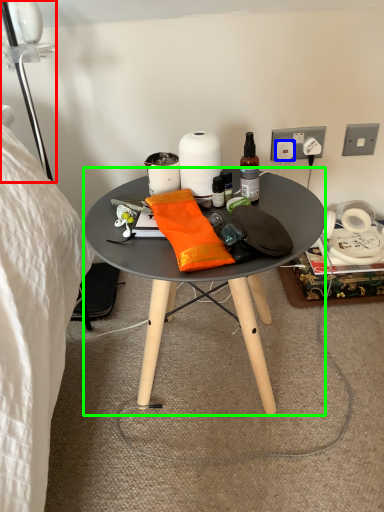
Question: Which is nearer to the lamp (highlighted by a red box)? power outlet (highlighted by a blue box) or desk (highlighted by a green box).

Choices:
 (A) power outlet
 (B) desk

Answer: (B)